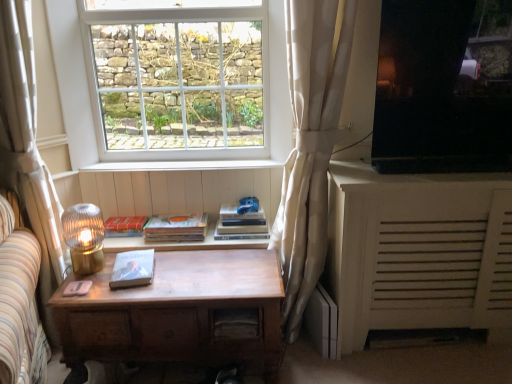
The height and width of the screenshot is (384, 512). What are the coordinates of `vacant space underneath matte white paperback book at center, marked as the 1th paperback book in a front-to-back arrangement (from a real-world perspective)` in the screenshot? It's located at (129, 278).